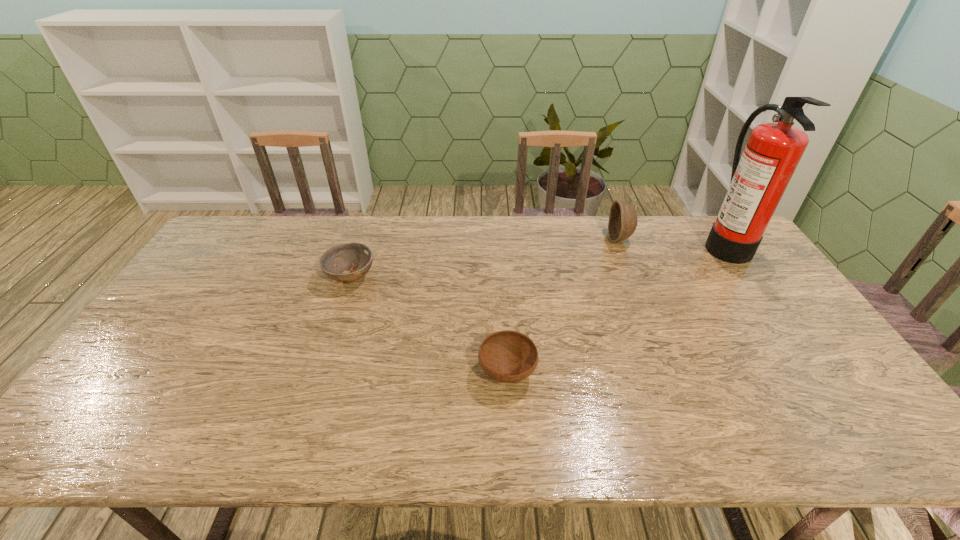
Image resolution: width=960 pixels, height=540 pixels. Find the location of `empty location between the fire extinguisher and the farthest bowl`. empty location between the fire extinguisher and the farthest bowl is located at coordinates (672, 241).

Identify the location of vacant space that's between the nearest bowl and the third shortest object. (564, 306).

Find the location of a particular element. The height and width of the screenshot is (540, 960). object that is the third nearest to the leftmost bowl is located at coordinates pyautogui.click(x=759, y=179).

Choose which object is the third nearest neighbor to the third object from left to right. Please provide its 2D coordinates. Your answer should be formatted as a tuple, i.e. [(x, y)], where the tuple contains the x and y coordinates of a point satisfying the conditions above.

[(356, 257)]

Locate an element on the screen. bowl that is the second closest to the fire extinguisher is located at coordinates (506, 356).

In order to click on the second closest bowl to the rightmost bowl in this screenshot , I will do `click(356, 257)`.

The height and width of the screenshot is (540, 960). In order to click on free space in the image that satisfies the following two spatial constraints: 1. on the back side of the tallest bowl; 2. on the left side of the nearest object in this screenshot , I will do `click(499, 239)`.

You are a GUI agent. You are given a task and a screenshot of the screen. Output one action in this format:
    pyautogui.click(x=<x>, y=<y>)
    Task: Click on the free location that satisfies the following two spatial constraints: 1. on the front-facing side of the tallest object; 2. on the front side of the nearest bowl
    This screenshot has height=540, width=960.
    Given the screenshot: What is the action you would take?
    pyautogui.click(x=814, y=372)